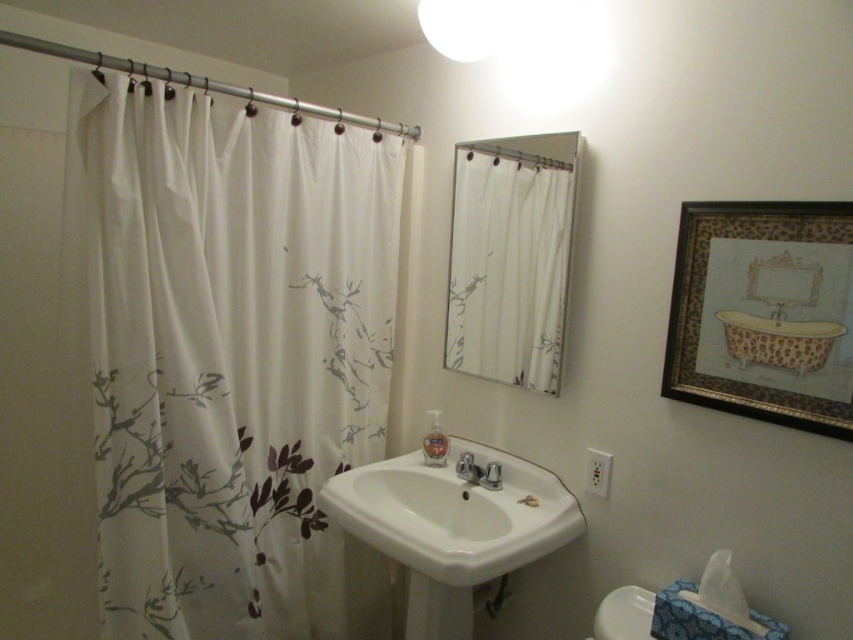
What do you see at coordinates (454, 513) in the screenshot? I see `white glossy sink at center` at bounding box center [454, 513].

Identify the location of white glossy sink at center. This screenshot has height=640, width=853. (454, 513).

Can you confirm if white fabric shower curtain at left is smaller than satin nickel faucet at sink center?

Actually, white fabric shower curtain at left might be larger than satin nickel faucet at sink center.

Is point (160, 93) in front of point (471, 465)?

Yes, it is in front of point (471, 465).

The image size is (853, 640). Identify the location of white fabric shower curtain at left. (228, 356).

Identify the location of white glossy sink at center. The height and width of the screenshot is (640, 853). (454, 513).

Looking at this image, is white glossy sink at center to the left of satin nickel faucet at sink center from the viewer's perspective?

Indeed, white glossy sink at center is positioned on the left side of satin nickel faucet at sink center.

The image size is (853, 640). Find the location of `white glossy sink at center`. white glossy sink at center is located at coordinates (454, 513).